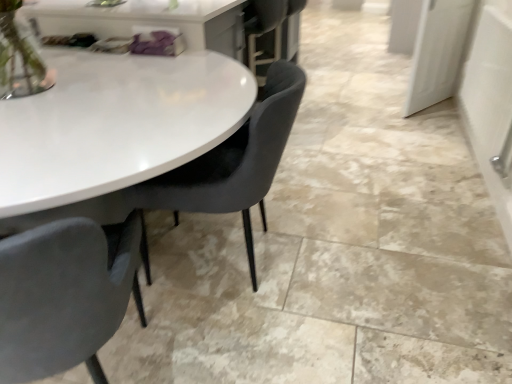
Find the location of a particular element. Image resolution: width=512 pixels, height=384 pixels. free space in front of white glossy door at upper right is located at coordinates (425, 124).